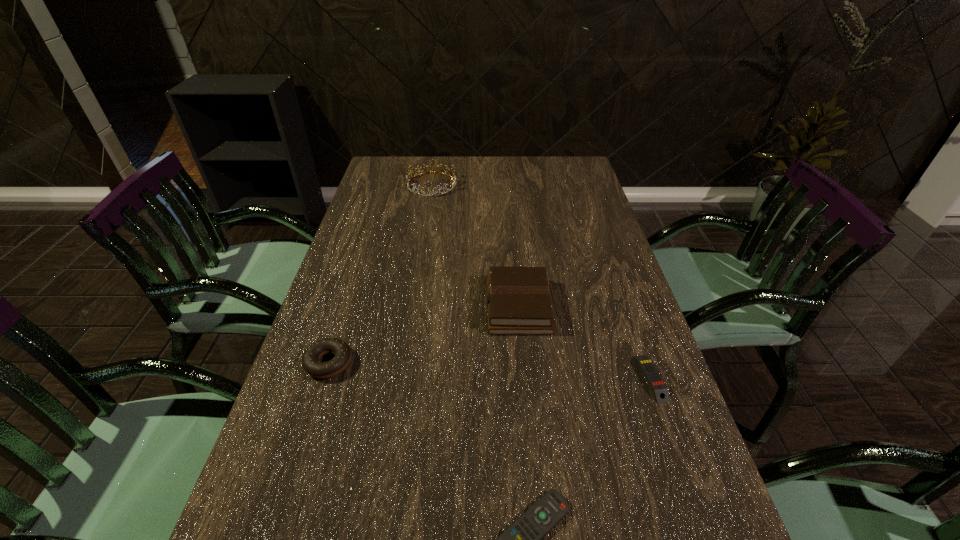
Where is `free location that satisfies the following two spatial constraints: 1. on the front-facing side of the farthest object; 2. on the right side of the taller remote control`? free location that satisfies the following two spatial constraints: 1. on the front-facing side of the farthest object; 2. on the right side of the taller remote control is located at coordinates (399, 378).

At what (x,y) coordinates should I click in order to perform the action: click on free spot that satisfies the following two spatial constraints: 1. on the spine side of the fourth nearest object; 2. on the left side of the farther remote control. Please return your answer as a coordinate pair (x, y). This screenshot has height=540, width=960. Looking at the image, I should click on (525, 378).